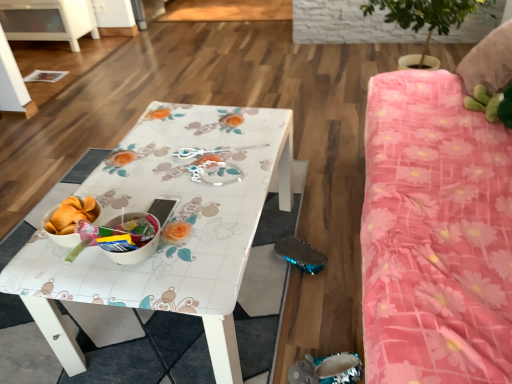
Measure the distance between white glossy table at center and camera.

The depth of white glossy table at center is 35.15 inches.

Locate an element on the screen. The image size is (512, 384). white glossy table at center is located at coordinates (167, 226).

Where is `bed on the right side of clear plastic spoon at center`? bed on the right side of clear plastic spoon at center is located at coordinates (438, 225).

Considering the positions of point (253, 147) and point (417, 83), is point (253, 147) closer or farther from the camera than point (417, 83)?

Clearly, point (253, 147) is closer to the camera than point (417, 83).

From the image's perspective, which object appears higher, clear plastic spoon at center or pink floral fabric bed at right?

From the image's view, clear plastic spoon at center is above.

From a real-world perspective, is clear plastic spoon at center physically located above or below pink floral fabric bed at right?

In terms of real-world spatial position, clear plastic spoon at center is above pink floral fabric bed at right.

Which object is further away from the camera, clear plastic spoon at center or white glossy table at center?

Positioned behind is clear plastic spoon at center.

Is clear plastic spoon at center not inside white glossy table at center?

Actually, clear plastic spoon at center is within white glossy table at center.

Which object is wider, clear plastic spoon at center or white glossy table at center?

white glossy table at center is wider.

From the image's perspective, is white glossy table at center located beneath clear plastic spoon at center?

Yes.

Is white glossy table at center situated inside clear plastic spoon at center or outside?

The correct answer is: outside.

This screenshot has width=512, height=384. In order to click on twin above the white glossy table at center (from a real-world perspective) in this screenshot , I will do `click(213, 151)`.

Is white glossy table at center located outside pink floral fabric bed at right?

Yes, white glossy table at center is outside of pink floral fabric bed at right.

This screenshot has height=384, width=512. I want to click on table lying behind the pink floral fabric bed at right, so click(x=167, y=226).

Based on their sizes in the image, would you say white glossy table at center is bigger or smaller than pink floral fabric bed at right?

white glossy table at center is smaller than pink floral fabric bed at right.

Are pink floral fabric bed at right and white glossy table at center located far from each other?

That's not correct — pink floral fabric bed at right is a little close to white glossy table at center.

From the image's perspective, which object appears higher, pink floral fabric bed at right or white glossy table at center?

pink floral fabric bed at right.

Locate an element on the screen. The image size is (512, 384). table behind the pink floral fabric bed at right is located at coordinates (167, 226).

From a real-world perspective, is pink floral fabric bed at right located beneath white glossy table at center?

No, from a real-world perspective, pink floral fabric bed at right is not under white glossy table at center.

From the image's perspective, is pink floral fabric bed at right on clear plastic spoon at center?

No, from the image's perspective, pink floral fabric bed at right is not above clear plastic spoon at center.

Between pink floral fabric bed at right and clear plastic spoon at center, which one has more height?

pink floral fabric bed at right.

From a real-world perspective, which object rests below the other?

pink floral fabric bed at right, from a real-world perspective.

This screenshot has height=384, width=512. Find the location of `bed below the clear plastic spoon at center (from a real-world perspective)`. bed below the clear plastic spoon at center (from a real-world perspective) is located at coordinates (438, 225).

Image resolution: width=512 pixels, height=384 pixels. Find the location of `table lying in front of the clear plastic spoon at center`. table lying in front of the clear plastic spoon at center is located at coordinates (167, 226).

Which object lies nearer to the anchor point clear plastic spoon at center, pink floral fabric bed at right or white glossy table at center?

Based on the image, white glossy table at center appears to be nearer to clear plastic spoon at center.

Considering their positions, is pink floral fabric bed at right positioned closer to white glossy table at center than clear plastic spoon at center?

clear plastic spoon at center is positioned closer to the anchor white glossy table at center.

Estimate the real-world distances between objects in this image. Which object is closer to white glossy table at center, clear plastic spoon at center or pink floral fabric bed at right?

The object closer to white glossy table at center is clear plastic spoon at center.

Based on their spatial positions, is white glossy table at center or clear plastic spoon at center closer to pink floral fabric bed at right?

The object closer to pink floral fabric bed at right is white glossy table at center.

Considering their positions, is clear plastic spoon at center positioned further to pink floral fabric bed at right than white glossy table at center?

Based on the image, clear plastic spoon at center appears to be further to pink floral fabric bed at right.

Looking at the image, which one is located closer to clear plastic spoon at center, white glossy table at center or pink floral fabric bed at right?

Based on the image, white glossy table at center appears to be nearer to clear plastic spoon at center.

Where is `table located between pink floral fabric bed at right and clear plastic spoon at center in the depth direction`? table located between pink floral fabric bed at right and clear plastic spoon at center in the depth direction is located at coordinates pos(167,226).